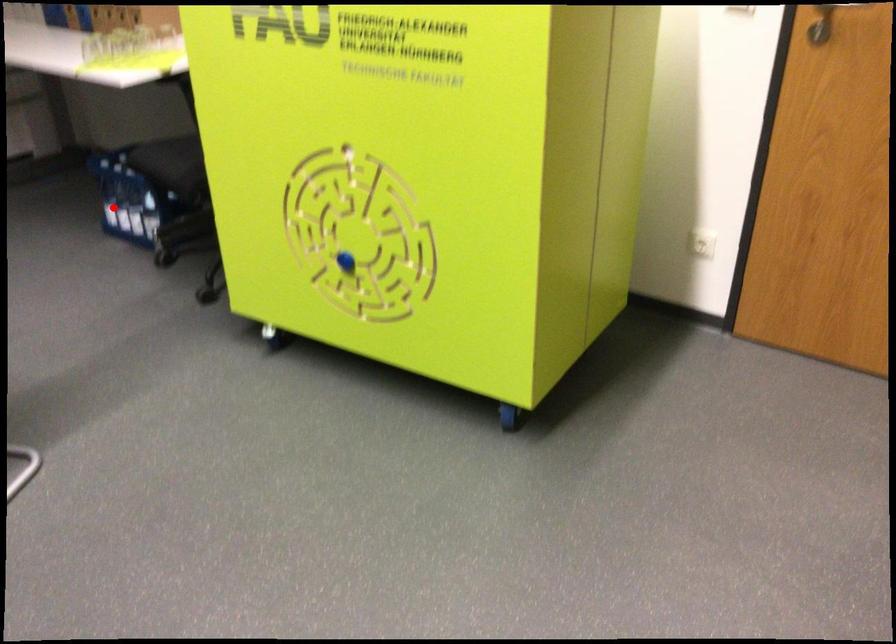
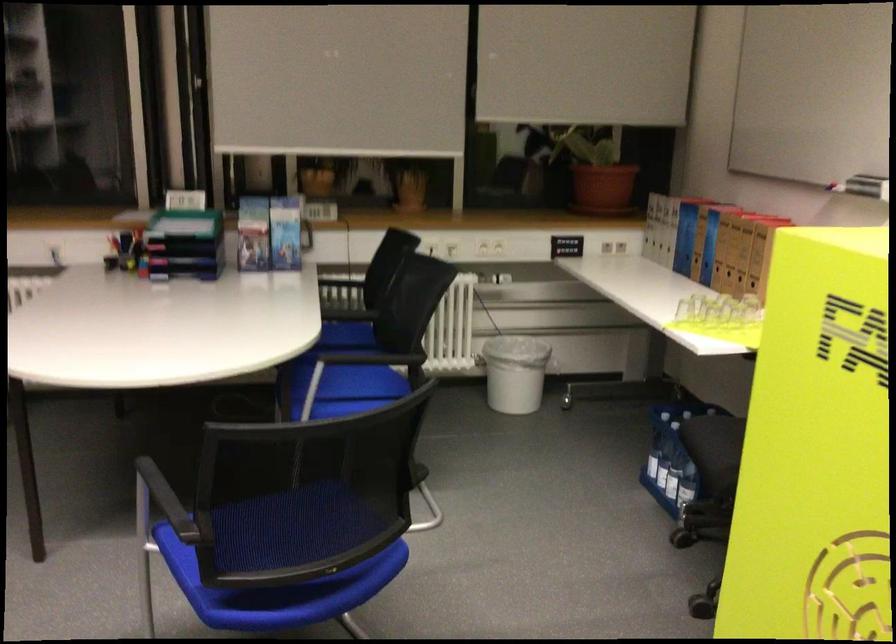
Where in the second image is the point corresponding to the highlighted location from the first image?

(650, 458)